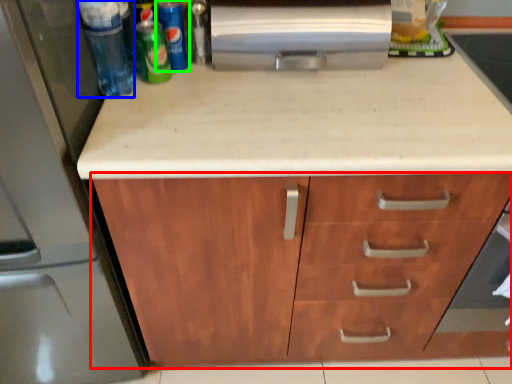
Question: Based on their relative distances, which object is nearer to cabinetry (highlighted by a red box)? Choose from beverage (highlighted by a blue box) and beer (highlighted by a green box).

Choices:
 (A) beverage
 (B) beer

Answer: (A)